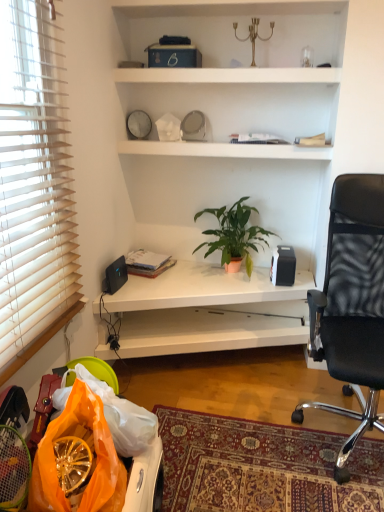
Question: Based on their sizes in the image, would you say black matte speaker at upper right, acting as the first loudspeaker starting from the right, is bigger or smaller than matte black book at left?

Choices:
 (A) small
 (B) big

Answer: (B)

Question: Do you think black matte speaker at upper right, acting as the first loudspeaker starting from the right, is within matte black book at left, or outside of it?

Choices:
 (A) inside
 (B) outside

Answer: (B)

Question: Which of these objects is positioned farthest from the matte black book at left?

Choices:
 (A) black mesh office chair at right
 (B) black plastic speaker at lower left, the 1th loudspeaker when ordered from left to right
 (C) white glossy desk at center
 (D) black matte speaker at upper right, acting as the first loudspeaker starting from the right
 (E) green matte plant at center

Answer: (A)

Question: Estimate the real-world distances between objects in this image. Which object is farther from the black matte speaker at upper right, which ranks as the second loudspeaker in left-to-right order?

Choices:
 (A) green matte plant at center
 (B) matte silver clock at upper center
 (C) black mesh office chair at right
 (D) matte black book at left
 (E) white glossy desk at center

Answer: (B)